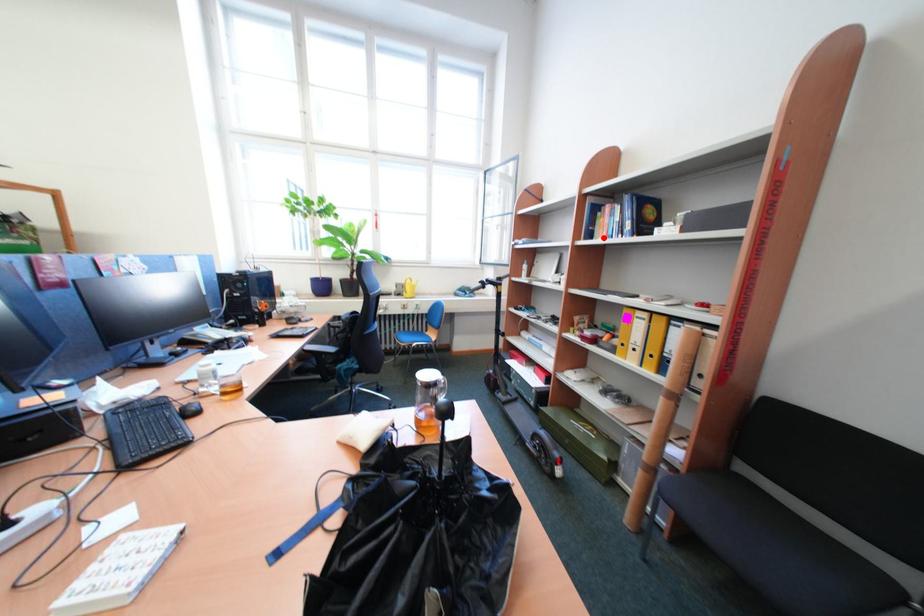
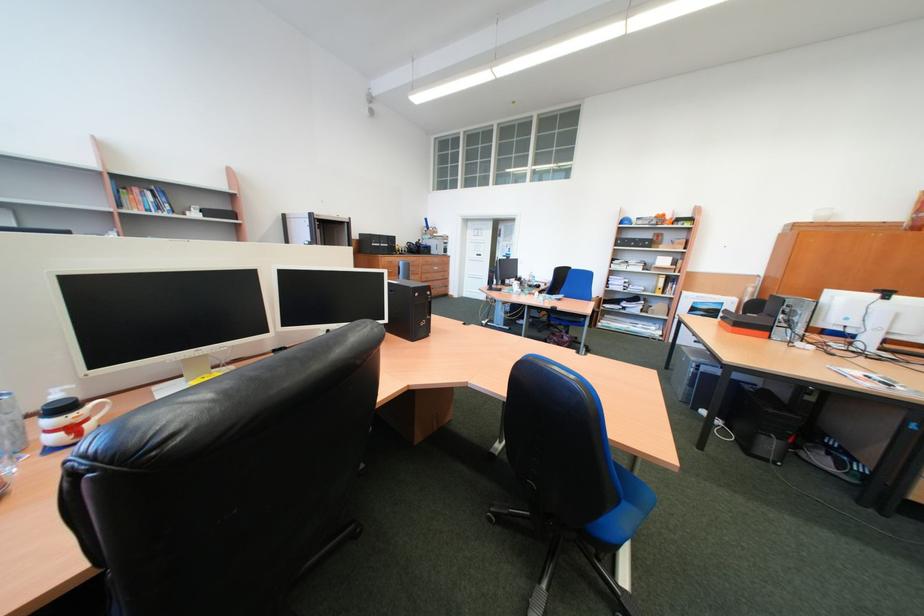
Question: I am providing you with two images of the same scene from different viewpoints. A red point is marked on the first image. Can you still see the location of the red point in image 2?

Choices:
 (A) Yes
 (B) No

Answer: (A)